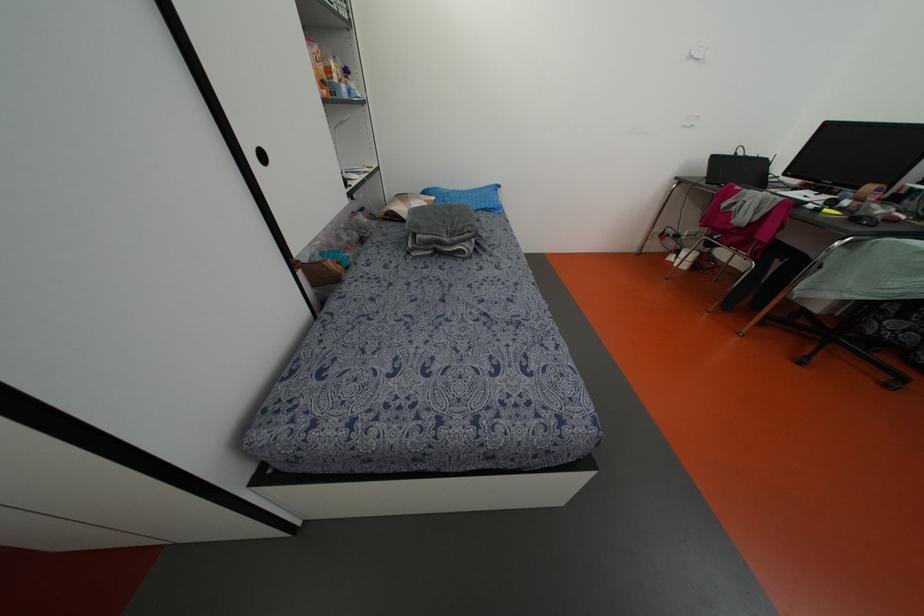
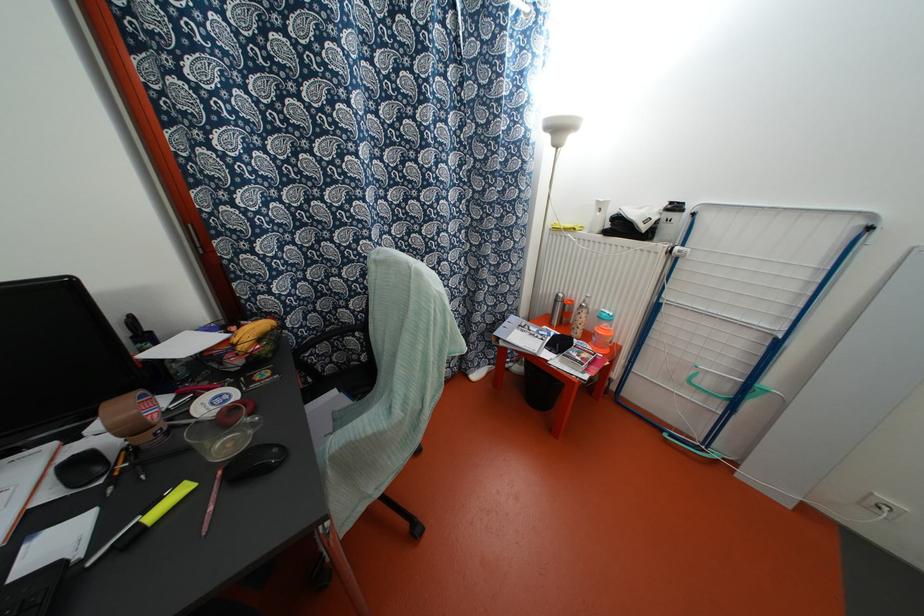
Find the pixel in the second image that matches (x=825, y=209) in the first image.

(152, 515)